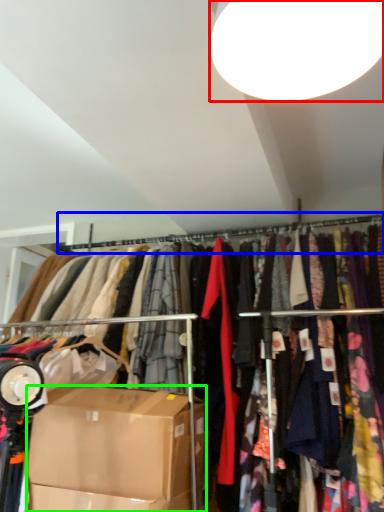
Question: Which object is positioned closest to lamp (highlighted by a red box)? Select from clothesline (highlighted by a blue box) and box (highlighted by a green box).

Choices:
 (A) clothesline
 (B) box

Answer: (B)